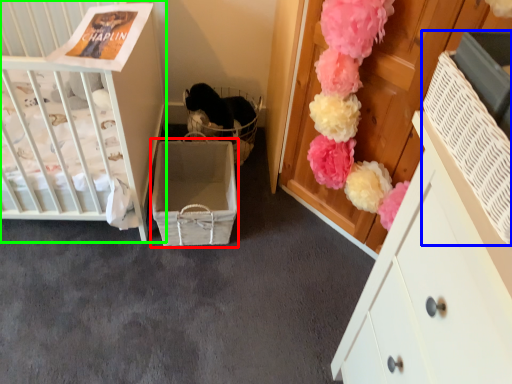
Question: Which is farther away from storage box (highlighted by a red box)? storage box (highlighted by a blue box) or infant bed (highlighted by a green box)?

Choices:
 (A) storage box
 (B) infant bed

Answer: (A)